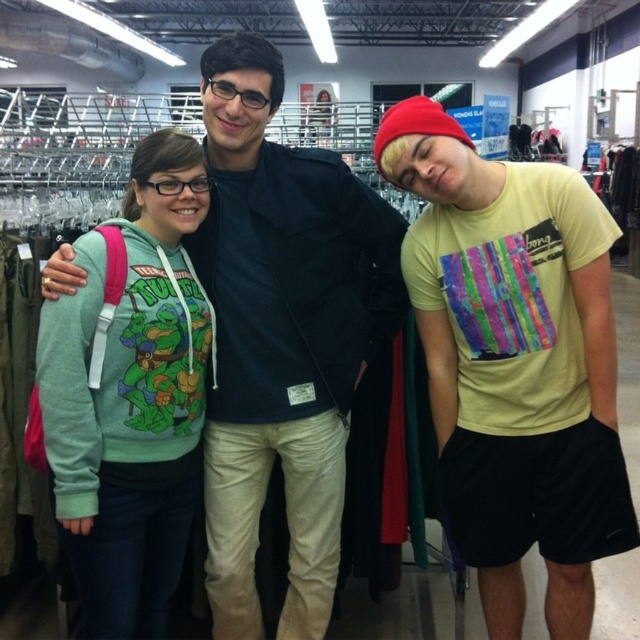
Question: Which object is closer to the camera taking this photo?

Choices:
 (A) yellow matte t-shirt at center
 (B) matte black jacket at center
 (C) heather gray hoodie at left

Answer: (A)

Question: Can you confirm if matte black jacket at center is positioned to the right of heather gray hoodie at left?

Choices:
 (A) yes
 (B) no

Answer: (A)

Question: Which of the following is the closest to the observer?

Choices:
 (A) (84, 624)
 (B) (259, 266)

Answer: (A)

Question: Where is matte black jacket at center located in relation to heather gray hoodie at left in the image?

Choices:
 (A) right
 (B) left

Answer: (A)

Question: Does matte black jacket at center appear on the right side of heather gray hoodie at left?

Choices:
 (A) yes
 (B) no

Answer: (A)

Question: Which is nearer to the heather gray hoodie at left?

Choices:
 (A) matte black jacket at center
 (B) yellow matte t-shirt at center

Answer: (A)